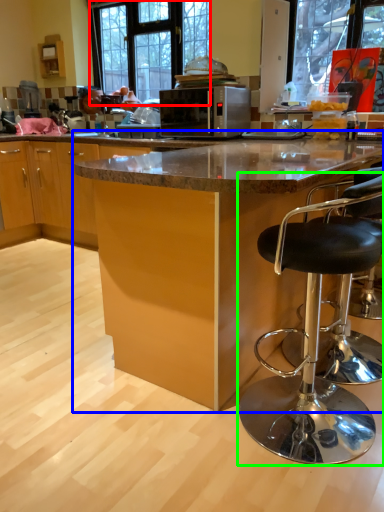
Question: Which is farther away from window (highlighted by a red box)? table (highlighted by a blue box) or chair (highlighted by a green box)?

Choices:
 (A) table
 (B) chair

Answer: (B)